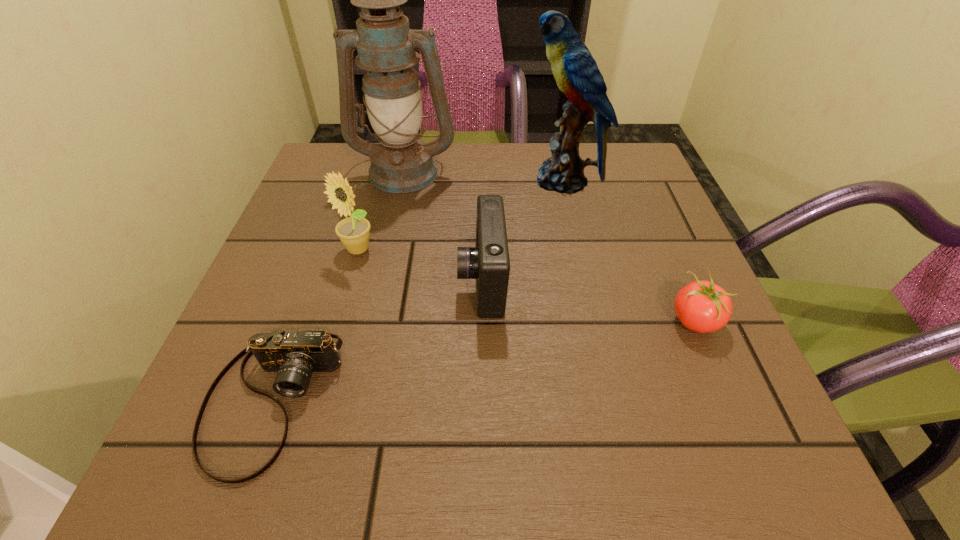
Identify the location of free region located on the face of the parrot. Image resolution: width=960 pixels, height=540 pixels. (483, 180).

Locate an element on the screen. This screenshot has width=960, height=540. vacant space situated on the face of the parrot is located at coordinates (419, 180).

Where is `free location located 0.110m on the face of the parrot`? The width and height of the screenshot is (960, 540). free location located 0.110m on the face of the parrot is located at coordinates (479, 180).

I want to click on free spot located on the face of the sunflower, so click(x=330, y=345).

Find the location of a particular element. The image size is (960, 540). vacant space located on the front-facing side of the taller camera is located at coordinates (348, 281).

Where is `free space located on the front-facing side of the taller camera`? The height and width of the screenshot is (540, 960). free space located on the front-facing side of the taller camera is located at coordinates (303, 281).

The image size is (960, 540). Identify the location of free space located on the front-facing side of the taller camera. (431, 281).

At what (x,y) coordinates should I click in order to perform the action: click on vacant space situated on the left of the second shortest object. Please return your answer as a coordinate pair (x, y). The width and height of the screenshot is (960, 540). Looking at the image, I should click on (609, 321).

I want to click on oil lamp that is at the far edge, so click(x=401, y=163).

Locate an element on the screen. parrot that is at the far edge is located at coordinates (576, 72).